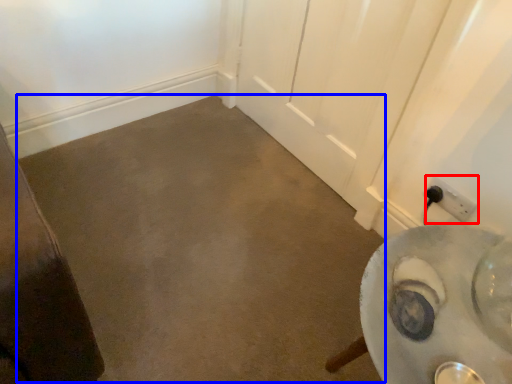
Question: Which point is further to the camera, power plugs and sockets (highlighted by a red box) or concrete (highlighted by a blue box)?

Choices:
 (A) power plugs and sockets
 (B) concrete

Answer: (A)